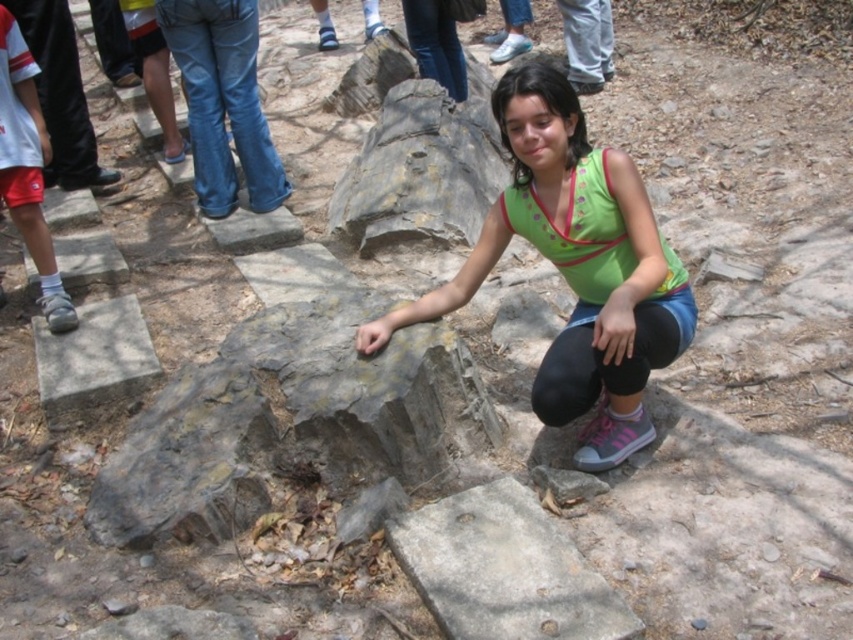
What do you see at coordinates (503, 570) in the screenshot? I see `gray rough stone at lower center` at bounding box center [503, 570].

Is gray rough stone at lower center thinner than gray concrete block at lower left?

Correct, gray rough stone at lower center's width is less than gray concrete block at lower left's.

Between point (556, 580) and point (111, 307), which one is positioned in front?

Positioned in front is point (556, 580).

You are a GUI agent. You are given a task and a screenshot of the screen. Output one action in this format:
    pyautogui.click(x=<x>, y=<y>)
    Task: Click on the gray rough stone at lower center
    
    Given the screenshot: What is the action you would take?
    pyautogui.click(x=503, y=570)

Between green fabric shirt at center and gray rough stone at lower center, which one appears on the left side from the viewer's perspective?

Positioned to the left is gray rough stone at lower center.

Does green fabric shirt at center come in front of gray rough stone at lower center?

No, it is not.

Is point (665, 324) positioned after point (537, 525)?

Yes, it is behind point (537, 525).

Locate an element on the screen. green fabric shirt at center is located at coordinates (575, 268).

Which is in front, point (601, 252) or point (125, 378)?

Point (601, 252) is more forward.

Between green fabric shirt at center and gray concrete block at lower left, which one is positioned higher?

Positioned higher is green fabric shirt at center.

What do you see at coordinates (575, 268) in the screenshot?
I see `green fabric shirt at center` at bounding box center [575, 268].

You are a GUI agent. You are given a task and a screenshot of the screen. Output one action in this format:
    pyautogui.click(x=<x>, y=<y>)
    Task: Click on the green fabric shirt at center
    
    Given the screenshot: What is the action you would take?
    pyautogui.click(x=575, y=268)